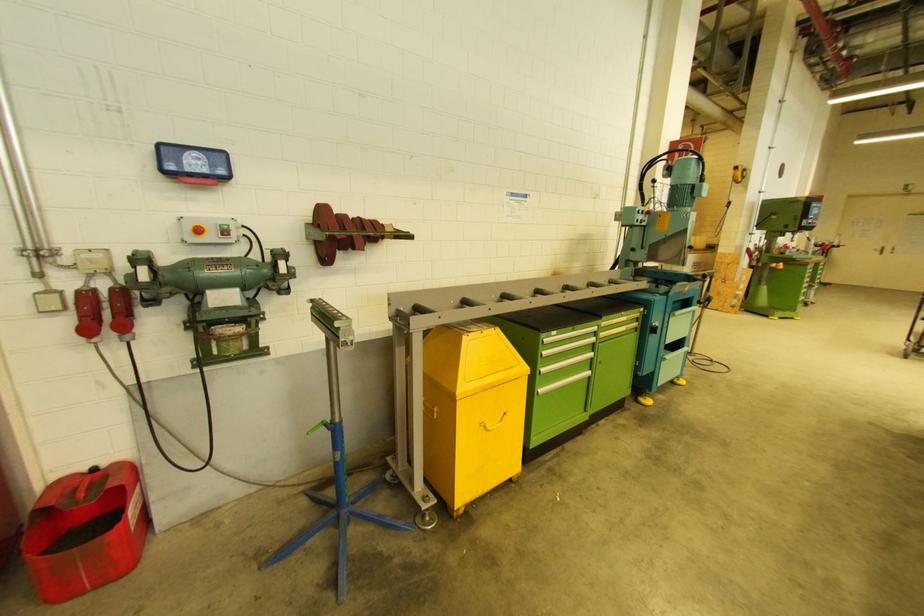
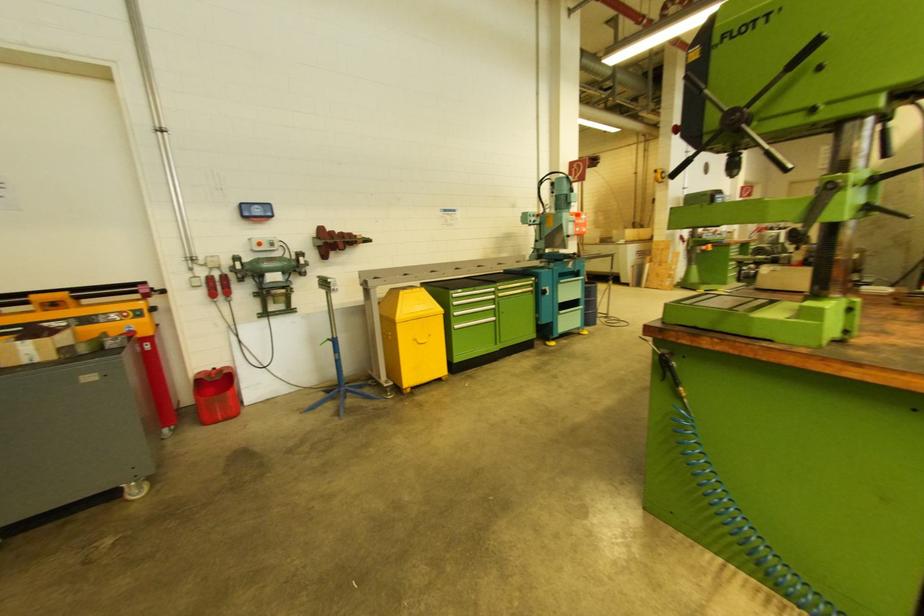
Locate, in the second image, the point that corresponds to the point at 655,331 in the first image.

(545, 294)